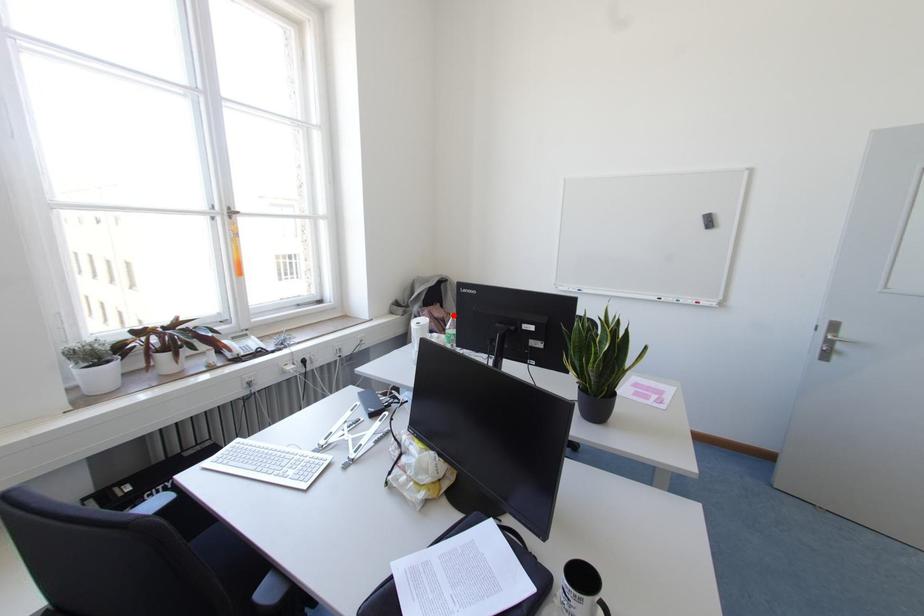
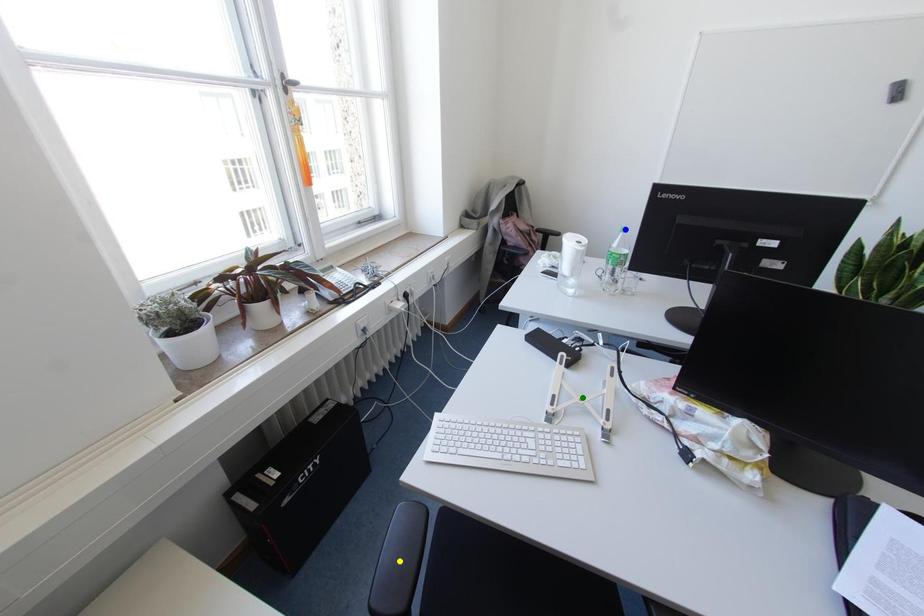
Question: I am providing you with two images of the same scene from different viewpoints. A red point is marked on the first image. You are given multiple points on the second image. Which point in image 2 is actually the same real-world point as the red point in image 1?

Choices:
 (A) blue point
 (B) green point
 (C) yellow point

Answer: (A)